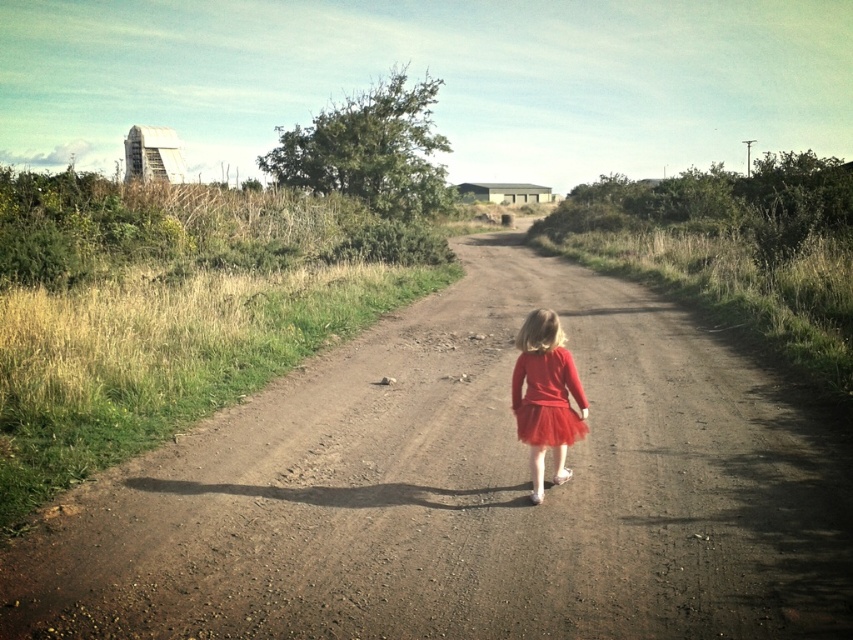
Who is more distant from viewer, (x=643, y=436) or (x=518, y=403)?

Positioned behind is point (x=643, y=436).

Can you confirm if brown dirt track at center is positioned below red tulle skirt at center?

Yes.

Where is `brown dirt track at center`? brown dirt track at center is located at coordinates (466, 492).